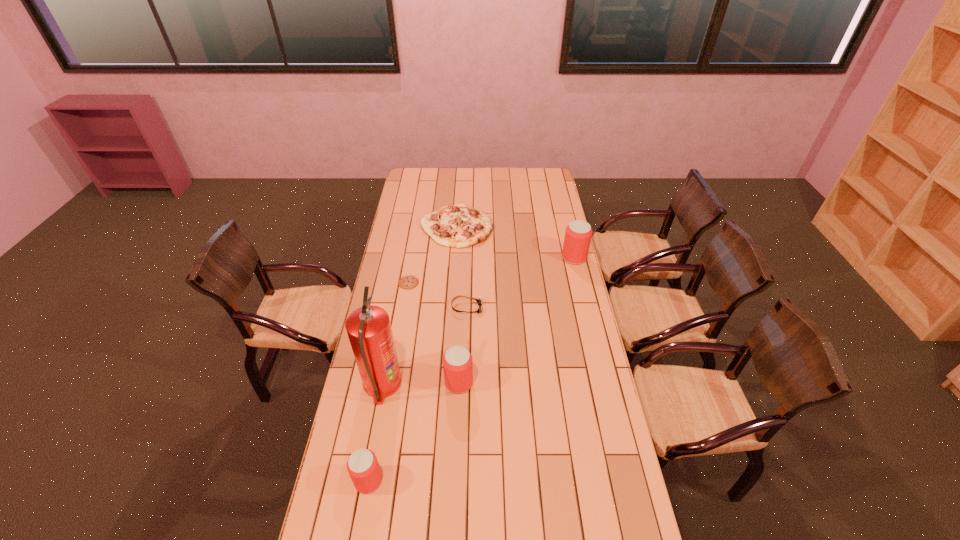
You are a GUI agent. You are given a task and a screenshot of the screen. Output one action in this format:
    pyautogui.click(x=<x>, y=<y>)
    Task: Click on the beer can object that ranks as the second closest to the tallest object
    The height and width of the screenshot is (540, 960).
    Given the screenshot: What is the action you would take?
    pyautogui.click(x=363, y=467)

Locate which beer can ranks second in proximity to the tallest object. Please provide its 2D coordinates. Your answer should be formatted as a tuple, i.e. [(x, y)], where the tuple contains the x and y coordinates of a point satisfying the conditions above.

[(363, 467)]

Locate an element on the screen. vacant point that satisfies the following two spatial constraints: 1. on the front side of the third tallest object; 2. on the left side of the farthest object is located at coordinates (447, 382).

Identify the location of vacant position in the image that satisfies the following two spatial constraints: 1. on the front side of the cookie; 2. on the instruction side of the fire extinguisher. (392, 384).